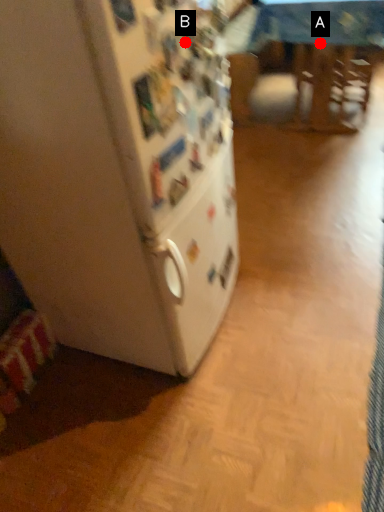
Question: Two points are circled on the image, labeled by A and B beside each circle. Which point is farther to the camera?

Choices:
 (A) A is further
 (B) B is further

Answer: (A)